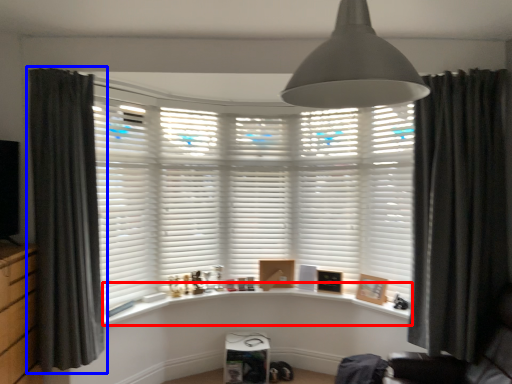
Question: Which object appears closest to the camera in this image, window sill (highlighted by a red box) or curtain (highlighted by a blue box)?

Choices:
 (A) window sill
 (B) curtain

Answer: (B)